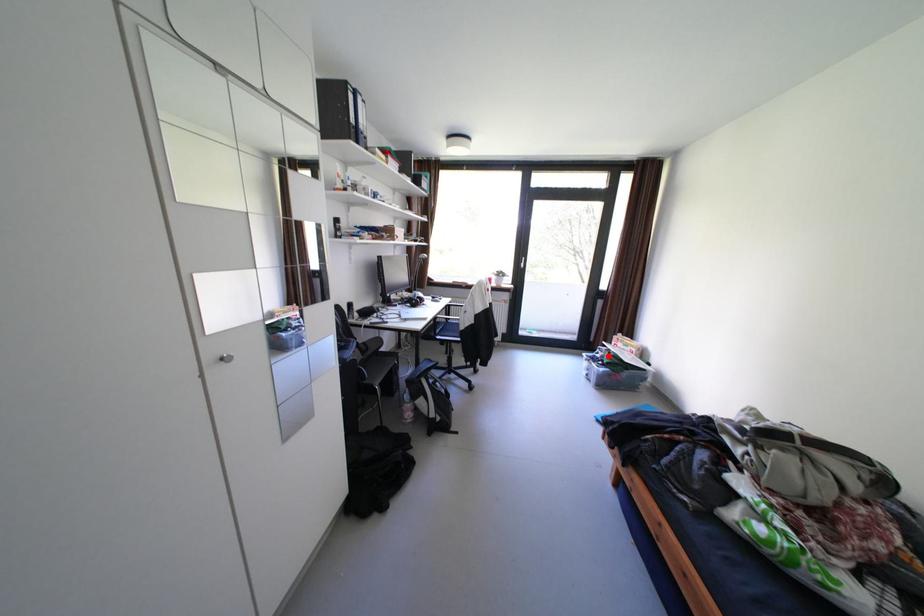
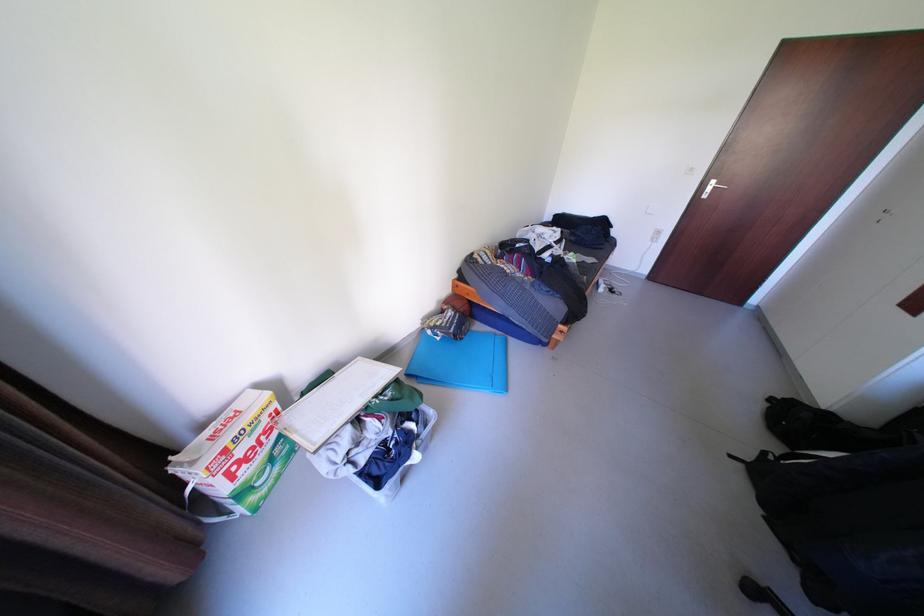
In the second image, find the point that corresponds to the highlighted location in the first image.

(372, 459)